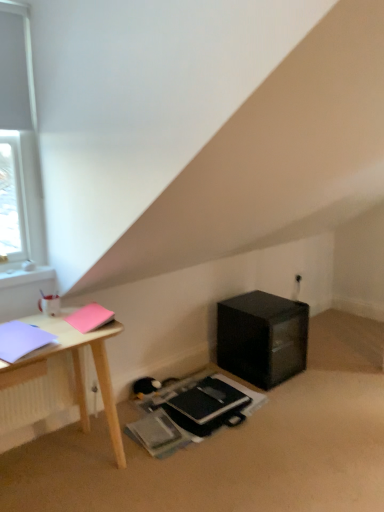
Question: In which direction should I rotate to look at black matte notebook at lower center, which is the third notebook in top-to-bottom order?

Choices:
 (A) left
 (B) right

Answer: (B)

Question: Does black plastic at lower right have a lesser height compared to white matte window at upper left?

Choices:
 (A) no
 (B) yes

Answer: (B)

Question: Is black plastic at lower right thinner than white matte window at upper left?

Choices:
 (A) yes
 (B) no

Answer: (B)

Question: Is black plastic at lower right far away from white matte window at upper left?

Choices:
 (A) no
 (B) yes

Answer: (B)

Question: Is the depth of black plastic at lower right less than that of white matte window at upper left?

Choices:
 (A) yes
 (B) no

Answer: (B)

Question: Is black plastic at lower right to the left of white matte window at upper left from the viewer's perspective?

Choices:
 (A) no
 (B) yes

Answer: (A)

Question: Is white matte window at upper left at the back of black plastic at lower right?

Choices:
 (A) yes
 (B) no

Answer: (B)

Question: Is black matte notebook at lower center, the first notebook when ordered from bottom to top, taller than white matte window at upper left?

Choices:
 (A) yes
 (B) no

Answer: (B)

Question: Is black matte notebook at lower center, which appears as the 3th notebook when viewed from the front, directly adjacent to white matte window at upper left?

Choices:
 (A) no
 (B) yes

Answer: (A)

Question: Is black matte notebook at lower center, placed as the 1th notebook when sorted from back to front, to the left of white matte window at upper left from the viewer's perspective?

Choices:
 (A) yes
 (B) no

Answer: (B)

Question: Can you confirm if black matte notebook at lower center, which is the third notebook in top-to-bottom order, is shorter than white matte window at upper left?

Choices:
 (A) no
 (B) yes

Answer: (B)

Question: Can you confirm if black matte notebook at lower center, which appears as the 3th notebook when viewed from the front, is positioned to the right of white matte window at upper left?

Choices:
 (A) yes
 (B) no

Answer: (A)

Question: Is black matte notebook at lower center, which is counted as the 1th notebook, starting from the right, wider than white matte window at upper left?

Choices:
 (A) yes
 (B) no

Answer: (A)

Question: Is the depth of pink matte notebook at upper left, which is the 3th notebook from bottom to top, greater than that of black matte notebook at lower center, the third notebook viewed from the left?

Choices:
 (A) yes
 (B) no

Answer: (B)